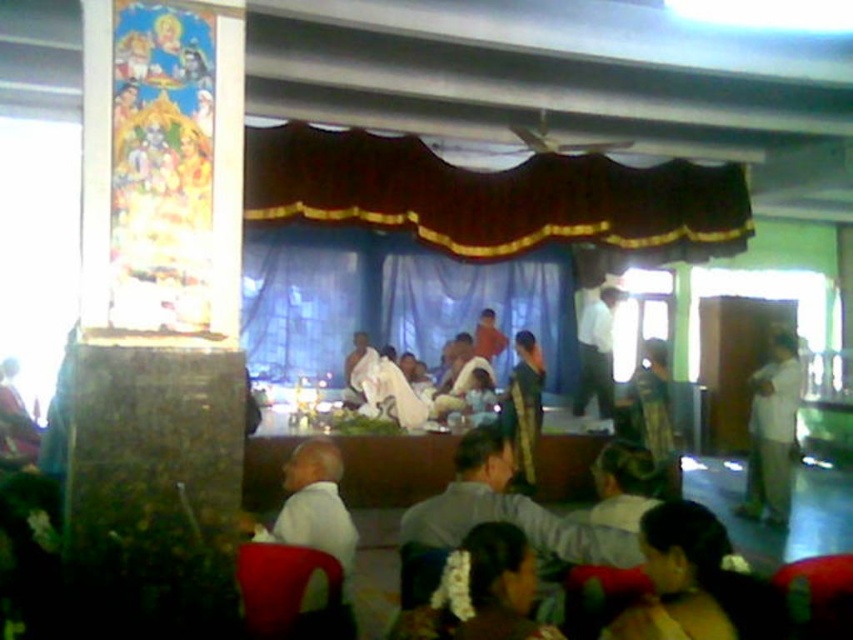
You are a photographer standing at the camera position. You want to take a photo of the white matte shirt at lower left. Is the shirt within your camera lens range if the minimum focus distance is 2 meters?

The distance between the white matte shirt at lower left and the camera is 2.46 meters, which is greater than the minimum focus distance of 2 meters. Therefore, the shirt is within the camera lens range and can be focused properly.

You are a photographer trying to capture a clear shot of both the white shirt at center and the white cloth at center. Since they are both white, you need to adjust your camera settings to ensure both are visible. However, you notice that one is to the right of the other. Which one is on the right side?

The white shirt at center is positioned on the right side of the white cloth at center.